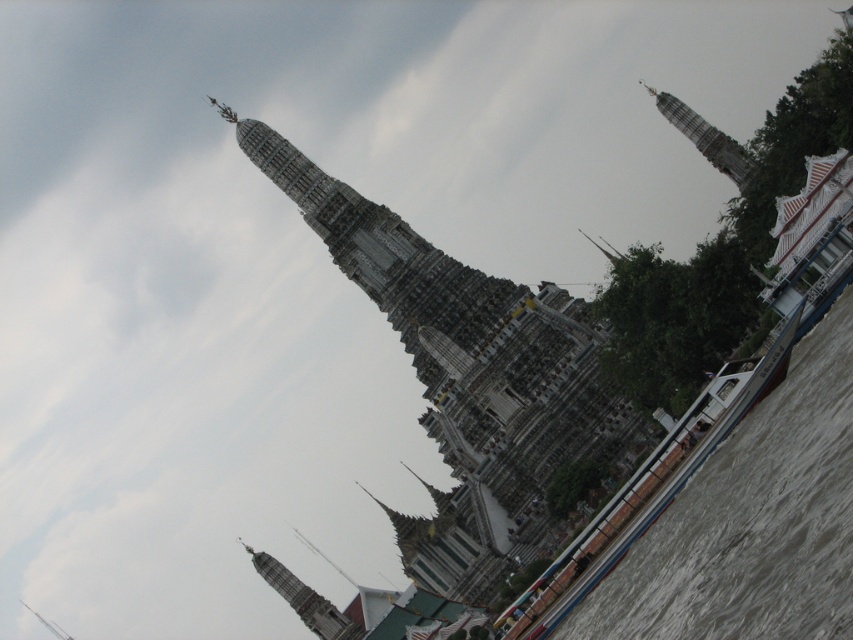
Question: Where is stone temple at center located in relation to smooth stone tower at upper center in the image?

Choices:
 (A) right
 (B) left

Answer: (A)

Question: Which point is closer to the camera?

Choices:
 (A) stone temple at center
 (B) gray stone tower at upper right

Answer: (A)

Question: Which point is closer to the camera?

Choices:
 (A) gray stone tower at upper right
 (B) smooth stone tower at upper center

Answer: (B)

Question: Is the position of stone temple at center more distant than that of gray stone tower at upper right?

Choices:
 (A) no
 (B) yes

Answer: (A)

Question: Which point is farther to the camera?

Choices:
 (A) gray stone tower at upper right
 (B) smooth stone tower at upper center

Answer: (A)

Question: Does stone temple at center appear on the right side of smooth stone tower at upper center?

Choices:
 (A) yes
 (B) no

Answer: (A)